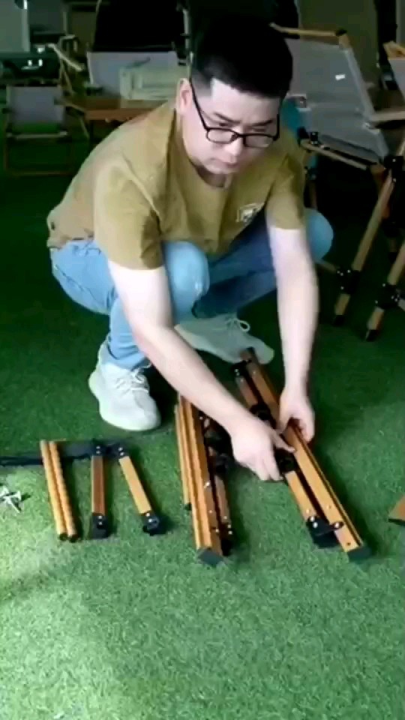
Where is `green carpet`? The width and height of the screenshot is (405, 720). green carpet is located at coordinates (231, 667).